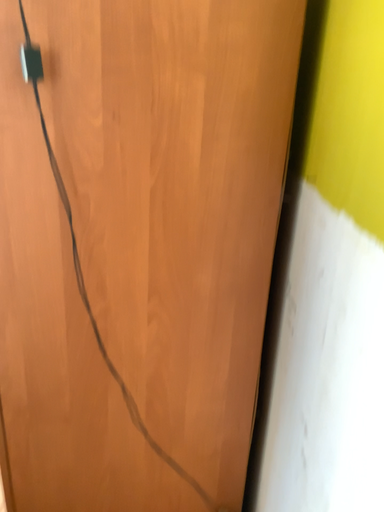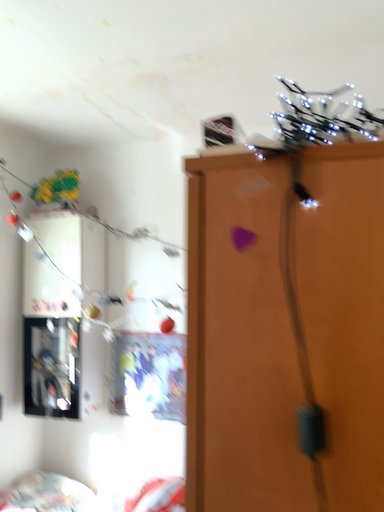
Question: Which way did the camera rotate in the video?

Choices:
 (A) rotated left
 (B) rotated right

Answer: (A)